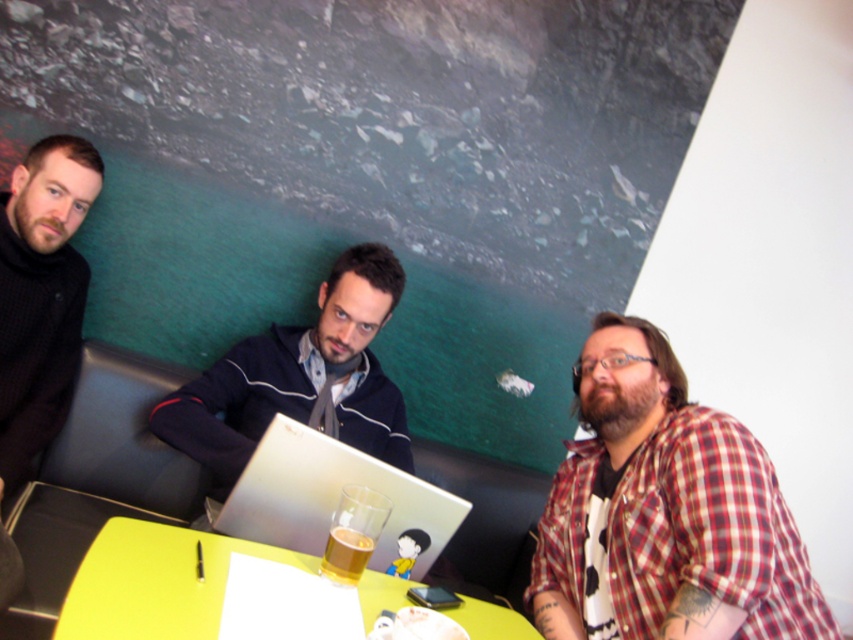
You are a photographer trying to capture a closeup of the silver metallic laptop at center. However, you notice the translucent glass beer at table center is blocking your view. Can you adjust your position to get a clear shot of the laptop without moving the beer?

The silver metallic laptop at center is further to the viewer than the translucent glass beer at table center, so you can move your camera closer to the laptop and position it behind the beer to capture a clear shot without moving the beer.